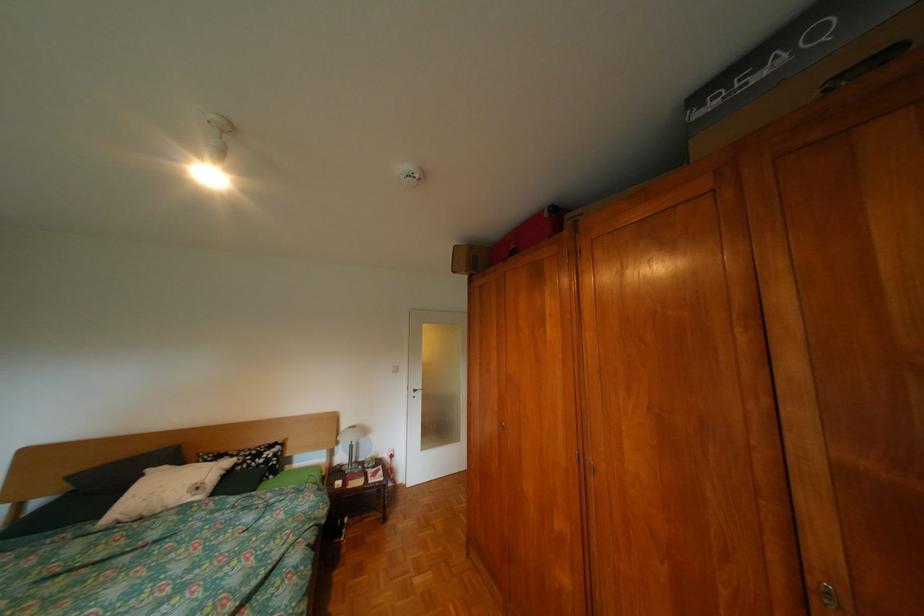
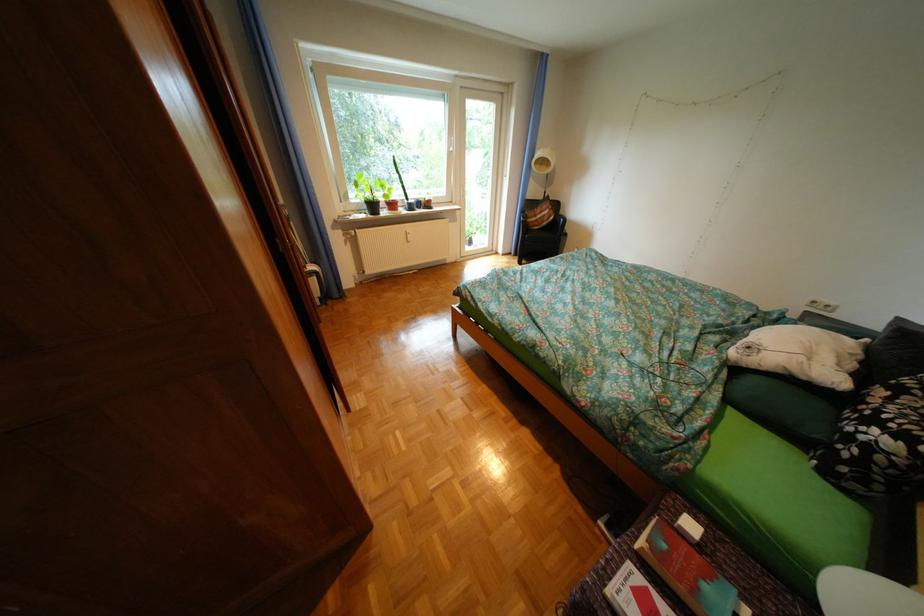
Locate, in the second image, the point that corresponds to the point at 381,480 in the first image.

(658, 565)